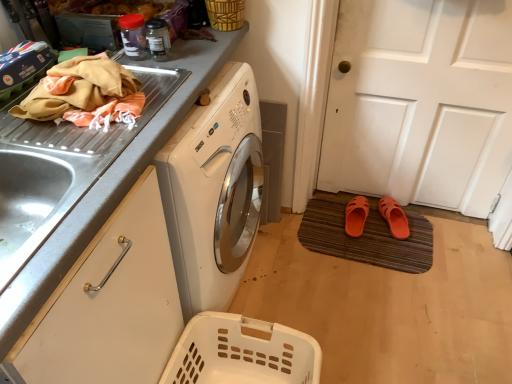
Identify the location of vacant region in front of brown textured doormat at lower right. Image resolution: width=512 pixels, height=384 pixels. (386, 312).